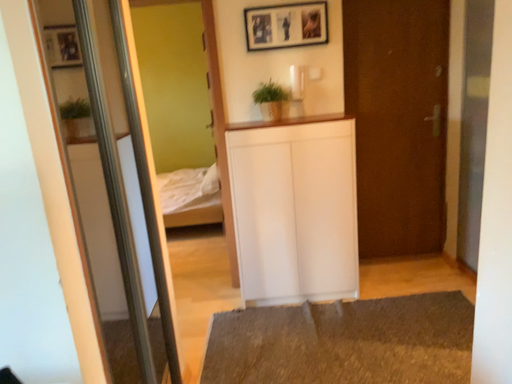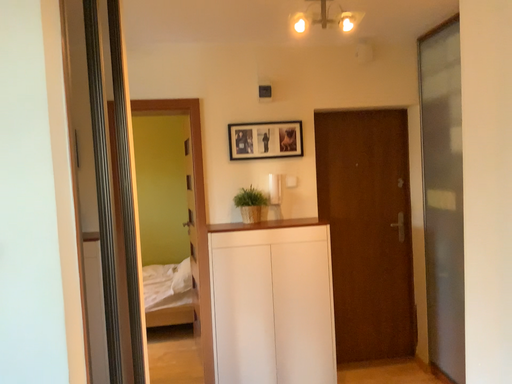
Question: Which way did the camera rotate in the video?

Choices:
 (A) rotated downward
 (B) rotated upward

Answer: (B)